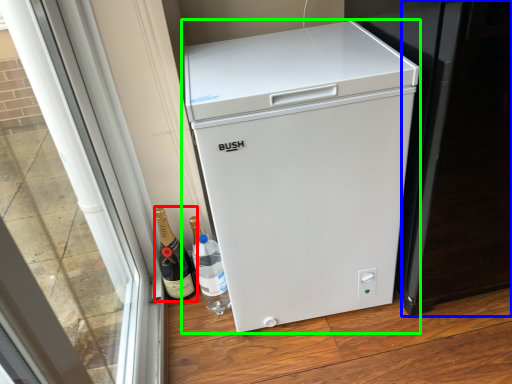
Question: Considering the real-world distances, which object is farthest from wine (highlighted by a red box)? screen door (highlighted by a blue box) or refrigerator (highlighted by a green box)?

Choices:
 (A) screen door
 (B) refrigerator

Answer: (A)